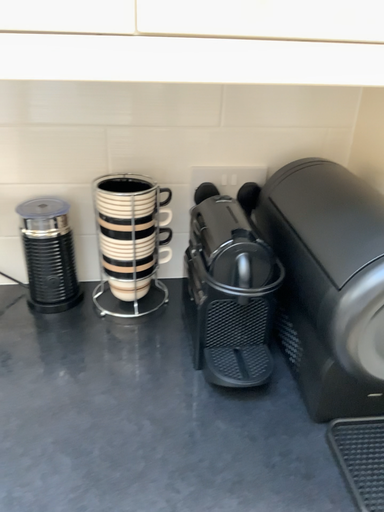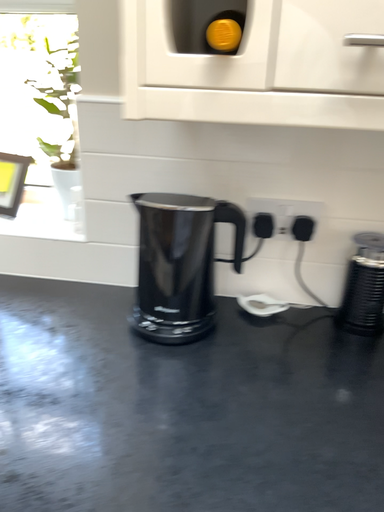
Question: How did the camera likely rotate when shooting the video?

Choices:
 (A) rotated left
 (B) rotated right

Answer: (A)